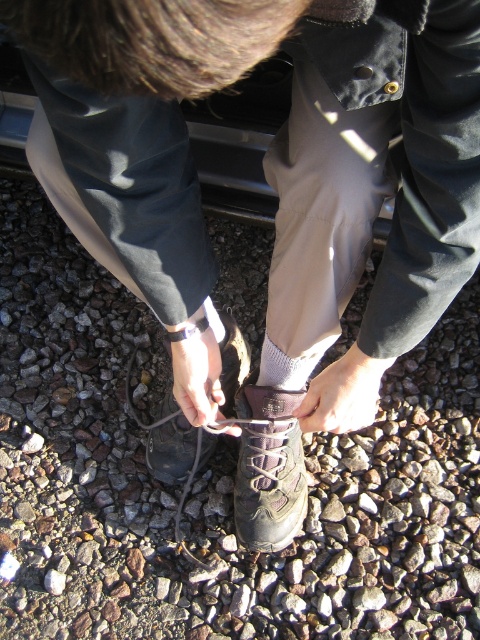
In the scene shown: Between metallic gray car at center and brown suede boot at center, which one appears on the left side from the viewer's perspective?

Positioned to the left is metallic gray car at center.

Is metallic gray car at center below brown suede boot at center?

Incorrect, metallic gray car at center is not positioned below brown suede boot at center.

Is point (244, 211) positioned in front of point (257, 445)?

That is False.

Where is `metallic gray car at center`? Image resolution: width=480 pixels, height=640 pixels. metallic gray car at center is located at coordinates (240, 140).

In the scene shown: Can you confirm if gray gravel at center is positioned below brown suede boot at center?

No, gray gravel at center is not below brown suede boot at center.

In the scene shown: Between gray gravel at center and brown suede boot at center, which one has less height?

With less height is brown suede boot at center.

You are a GUI agent. You are given a task and a screenshot of the screen. Output one action in this format:
    pyautogui.click(x=<x>, y=<y>)
    Task: Click on the gray gravel at center
    The width and height of the screenshot is (480, 640).
    Given the screenshot: What is the action you would take?
    pyautogui.click(x=216, y=477)

Is gray gravel at center positioned at the back of leather lace-up shoe at center?

Yes, it is behind leather lace-up shoe at center.

Can you confirm if gray gravel at center is positioned below leather lace-up shoe at center?

No, gray gravel at center is not below leather lace-up shoe at center.

Which is in front, point (163, 524) or point (224, 324)?

Positioned in front is point (224, 324).

Image resolution: width=480 pixels, height=640 pixels. I want to click on gray gravel at center, so click(216, 477).